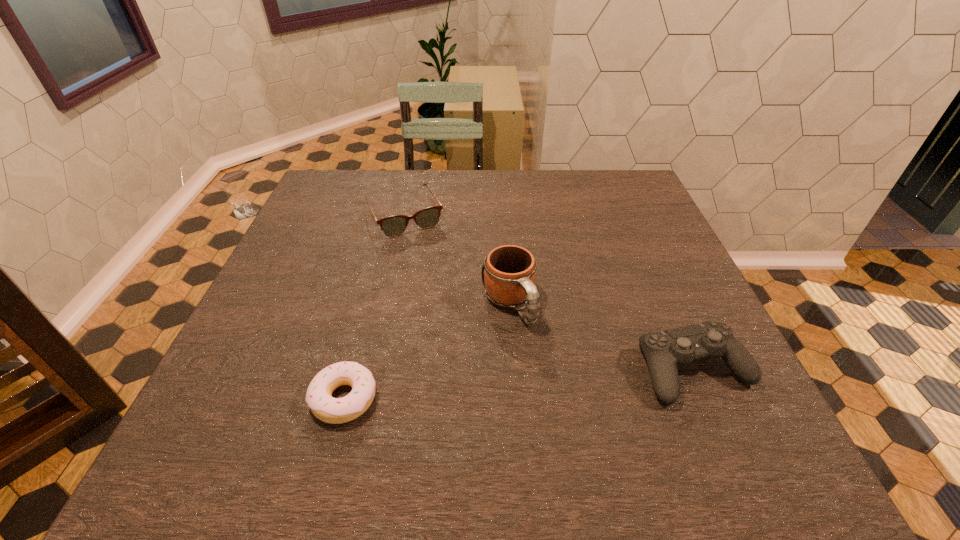
At what (x,y) coordinates should I click in order to perform the action: click on blank region between the rightmost object and the second object from right to left. Please return your answer as a coordinate pair (x, y). The image size is (960, 540). Looking at the image, I should click on (601, 336).

I want to click on vacant area between the shortest object and the spectacles, so click(374, 308).

Identify the location of vacant area that lies between the third nearest object and the second tallest object. The height and width of the screenshot is (540, 960). (601, 336).

The width and height of the screenshot is (960, 540). Find the location of `vacant space in between the mug and the doughnut`. vacant space in between the mug and the doughnut is located at coordinates (426, 351).

I want to click on vacant region between the second farthest object and the shortest object, so click(426, 351).

Image resolution: width=960 pixels, height=540 pixels. I want to click on object that is the closest one to the doughnut, so click(509, 275).

Locate which object is the third closest to the third object from left to right. Please provide its 2D coordinates. Your answer should be formatted as a tuple, i.e. [(x, y)], where the tuple contains the x and y coordinates of a point satisfying the conditions above.

[(319, 398)]

Locate an element on the screen. The height and width of the screenshot is (540, 960). vacant space that satisfies the following two spatial constraints: 1. on the back side of the rightmost object; 2. on the right side of the shortest object is located at coordinates (352, 369).

You are a GUI agent. You are given a task and a screenshot of the screen. Output one action in this format:
    pyautogui.click(x=<x>, y=<y>)
    Task: Click on the vacant space that satisfies the following two spatial constraints: 1. on the back side of the doughnut; 2. on the right side of the farthest object
    
    Given the screenshot: What is the action you would take?
    pyautogui.click(x=392, y=217)

I want to click on blank space that satisfies the following two spatial constraints: 1. on the front side of the third shortest object; 2. on the left side of the second object from right to left, so click(513, 369).